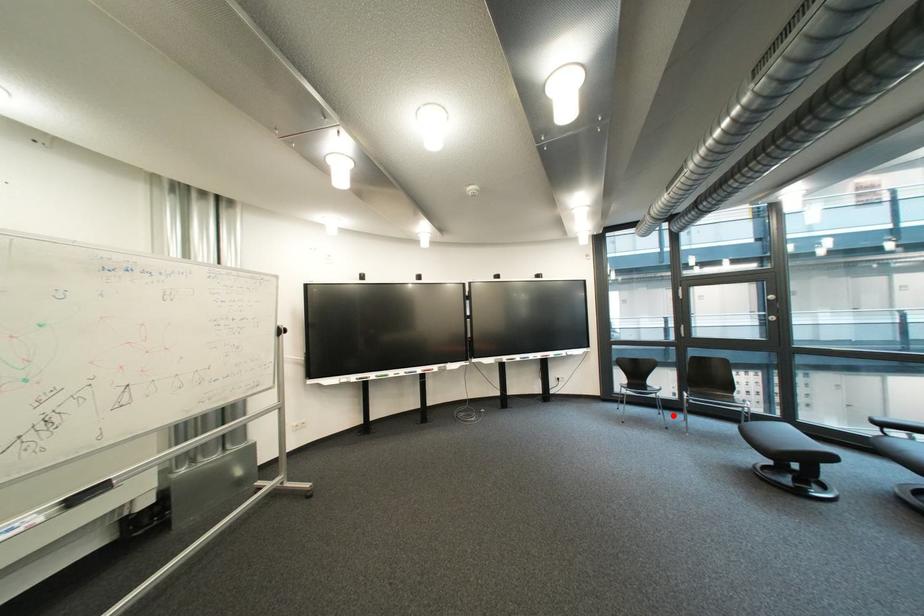
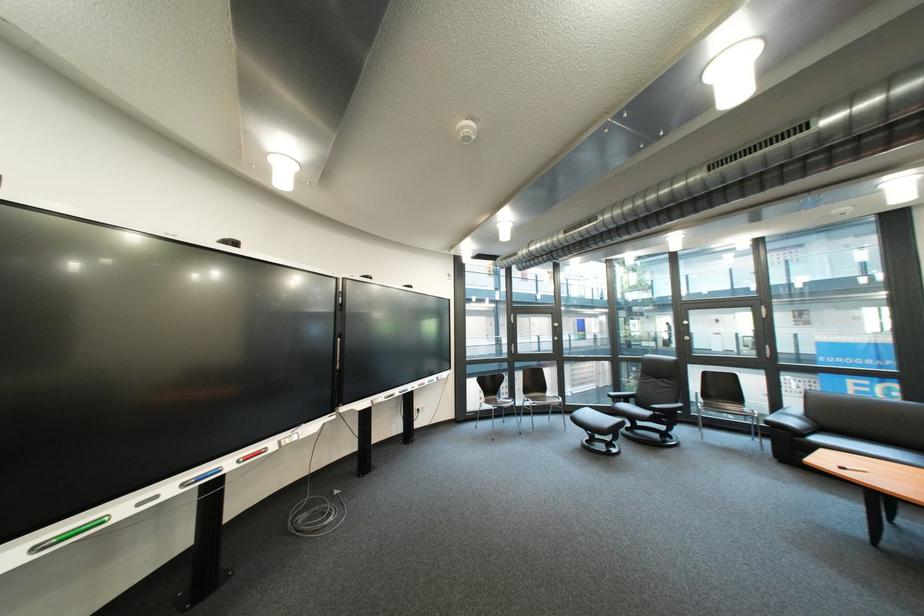
In the second image, find the point that corresponds to the highlighted location in the first image.

(517, 424)